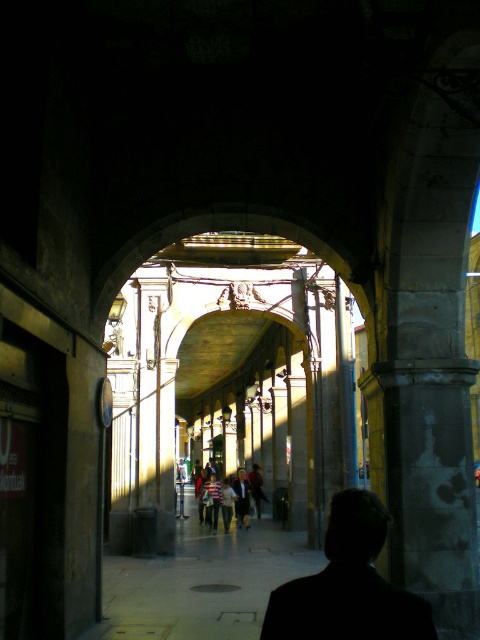
Does black matte suit at center have a greater height compared to dark gray suit at center?

Correct, black matte suit at center is much taller as dark gray suit at center.

This screenshot has height=640, width=480. Describe the element at coordinates (348, 584) in the screenshot. I see `black matte suit at center` at that location.

Based on the photo, measure the distance between point (294, 600) and camera.

They are 121.08 feet apart.

Find the location of a particular element. The width and height of the screenshot is (480, 640). black matte suit at center is located at coordinates (348, 584).

Is the position of black matte suit at center less distant than that of striped fabric shirt at center?

Yes, black matte suit at center is in front of striped fabric shirt at center.

Which is in front, point (336, 564) or point (253, 477)?

Point (336, 564) is more forward.

Find the location of a particular element. black matte suit at center is located at coordinates (348, 584).

In the scene shown: Which is above, striped fabric shirt at center or dark gray suit at center?

Positioned higher is dark gray suit at center.

Does striped fabric shirt at center have a lesser width compared to dark gray suit at center?

No.

Is point (233, 504) in front of point (245, 484)?

Yes, point (233, 504) is closer to viewer.

Locate an element on the screen. striped fabric shirt at center is located at coordinates (232, 497).